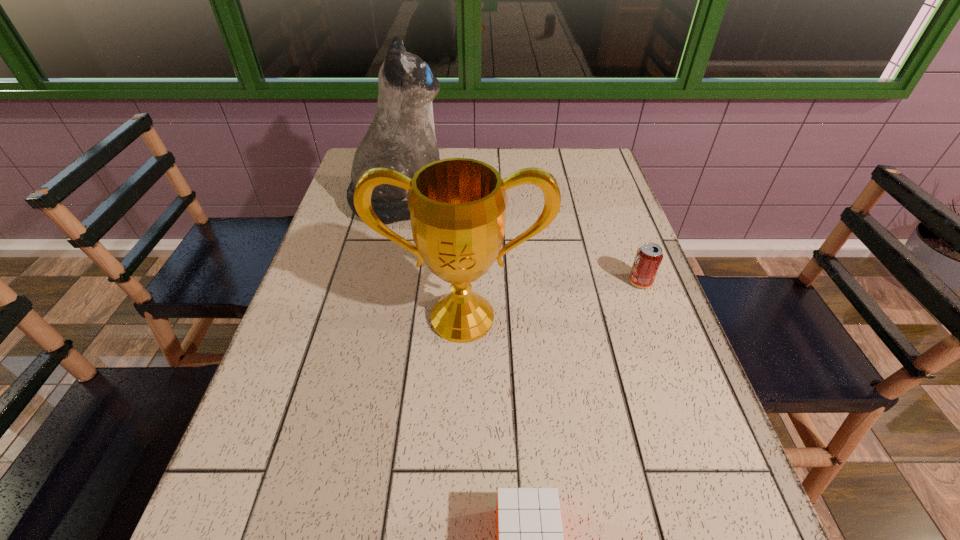
I want to click on the third closest object to the nearest object, so click(x=401, y=136).

This screenshot has height=540, width=960. Identify the location of vacant position in the image that satisfies the following two spatial constraints: 1. at the face of the cat; 2. on the left side of the third tallest object. (397, 282).

You are a GUI agent. You are given a task and a screenshot of the screen. Output one action in this format:
    pyautogui.click(x=<x>, y=<y>)
    Task: Click on the vacant region that satisfies the following two spatial constraints: 1. on the back side of the third tallest object; 2. at the face of the farthest object
    The height and width of the screenshot is (540, 960).
    Given the screenshot: What is the action you would take?
    pyautogui.click(x=611, y=202)

You are a GUI agent. You are given a task and a screenshot of the screen. Output one action in this format:
    pyautogui.click(x=<x>, y=<y>)
    Task: Click on the vacant area in the image that satisfies the following two spatial constraints: 1. at the face of the farthest object; 2. on the left side of the second shortest object
    The width and height of the screenshot is (960, 540).
    Given the screenshot: What is the action you would take?
    pyautogui.click(x=397, y=282)